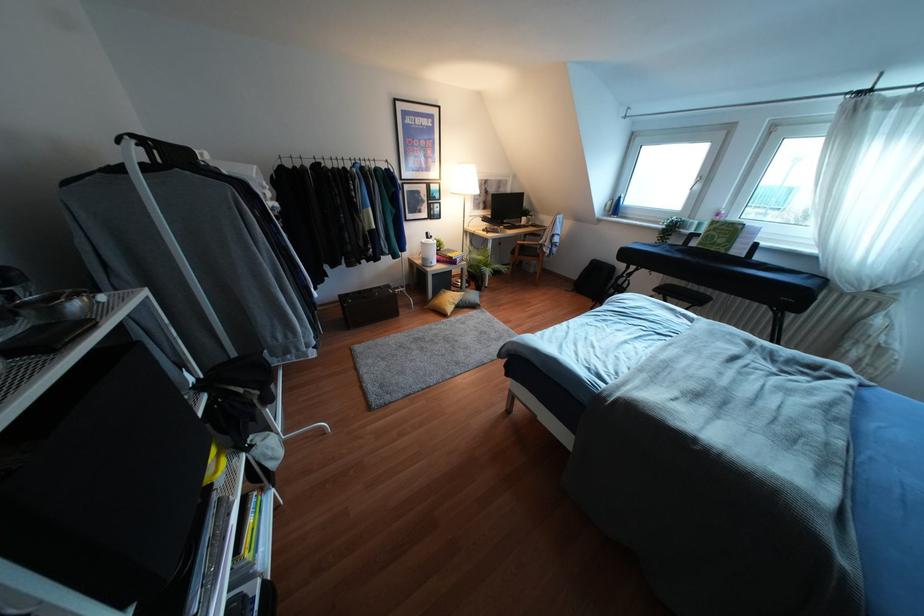
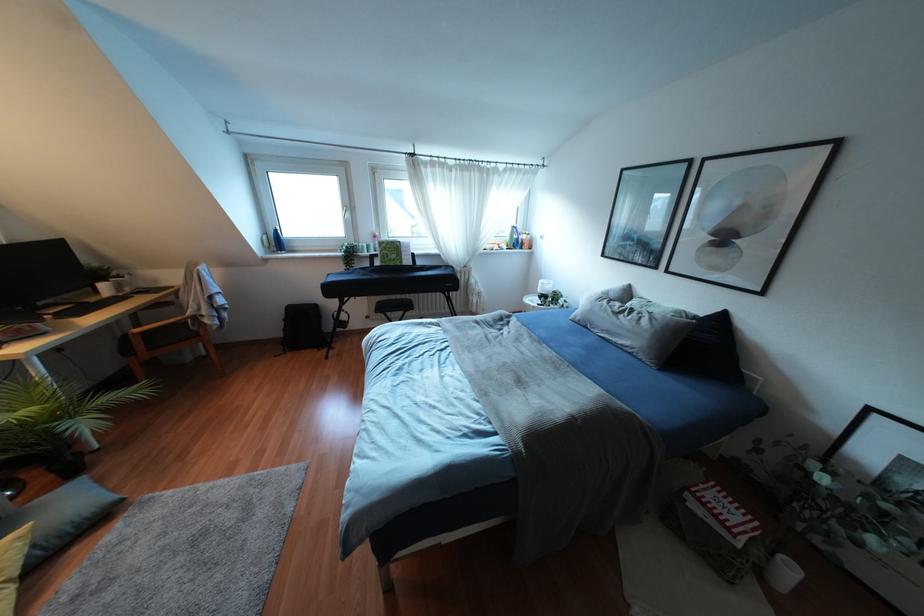
In the second image, find the point that corresponds to point (712, 236) in the first image.

(385, 254)